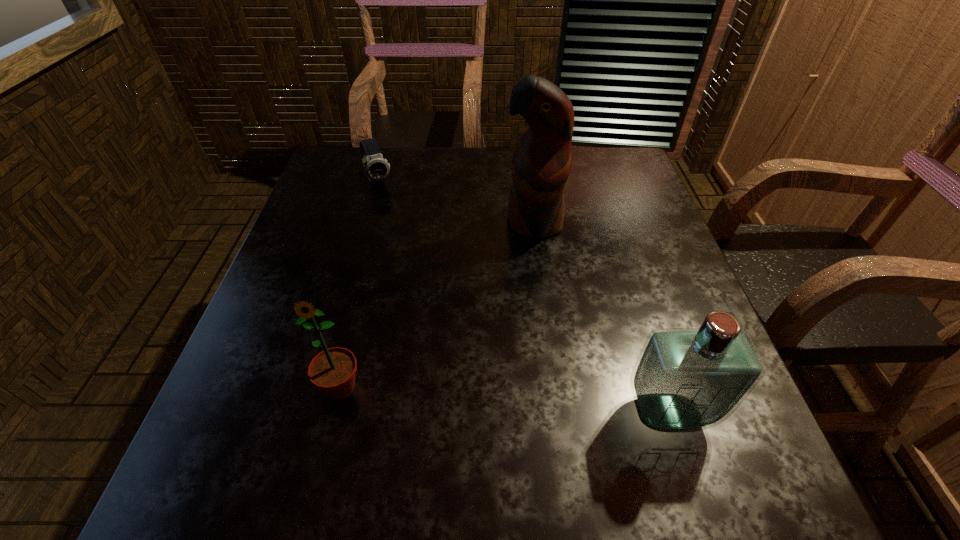
The image size is (960, 540). In order to click on object located in the near right corner section of the desktop in this screenshot , I will do `click(685, 379)`.

Where is `vacant space at the far edge of the desktop`? This screenshot has width=960, height=540. vacant space at the far edge of the desktop is located at coordinates (413, 173).

Image resolution: width=960 pixels, height=540 pixels. In the image, there is a desktop. What are the coordinates of `vacant space at the near edge` in the screenshot? It's located at (322, 435).

This screenshot has height=540, width=960. I want to click on vacant point at the left edge, so click(x=286, y=372).

The height and width of the screenshot is (540, 960). In the image, there is a desktop. Identify the location of blank space at the right edge. (626, 330).

I want to click on vacant space at the far left corner of the desktop, so coord(372,193).

In the image, there is a desktop. Where is `blank space at the near left corner`? The image size is (960, 540). blank space at the near left corner is located at coordinates (310, 404).

Image resolution: width=960 pixels, height=540 pixels. Identify the location of vacant space at the far right corner. (601, 163).

This screenshot has height=540, width=960. I want to click on free area in between the tallest object and the watch, so click(x=456, y=201).

Locate an element on the screen. Image resolution: width=960 pixels, height=540 pixels. free area in between the sunflower and the shortest object is located at coordinates (360, 285).